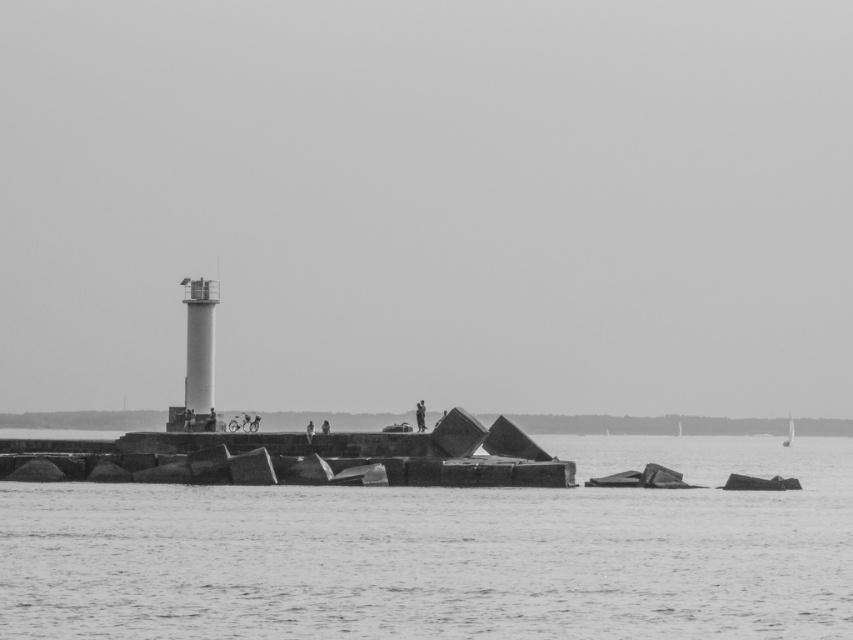
Question: Is smooth concrete water at center wider than white matte sailboat at center?

Choices:
 (A) yes
 (B) no

Answer: (A)

Question: Does smooth concrete water at center appear over white matte sailboat at center?

Choices:
 (A) yes
 (B) no

Answer: (A)

Question: Which point appears closest to the camera in this image?

Choices:
 (A) (785, 436)
 (B) (401, 534)

Answer: (B)

Question: Can you confirm if smooth concrete water at center is thinner than white matte sailboat at center?

Choices:
 (A) no
 (B) yes

Answer: (A)